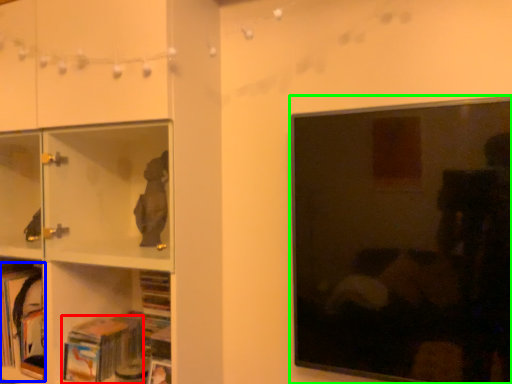
Question: Which is farther away from book (highlighted by a red box)? book (highlighted by a blue box) or picture frame (highlighted by a green box)?

Choices:
 (A) book
 (B) picture frame

Answer: (B)